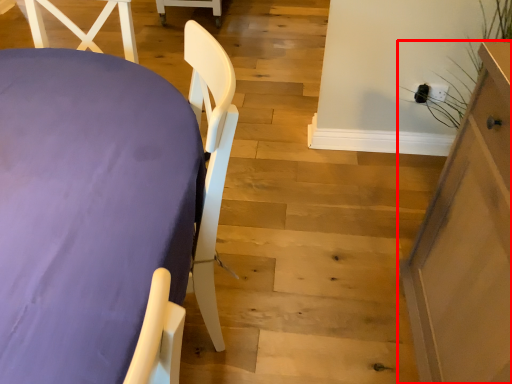
Question: Observing the image, what is the correct spatial positioning of furniture (annotated by the red box) in reference to furniture?

Choices:
 (A) right
 (B) left

Answer: (A)